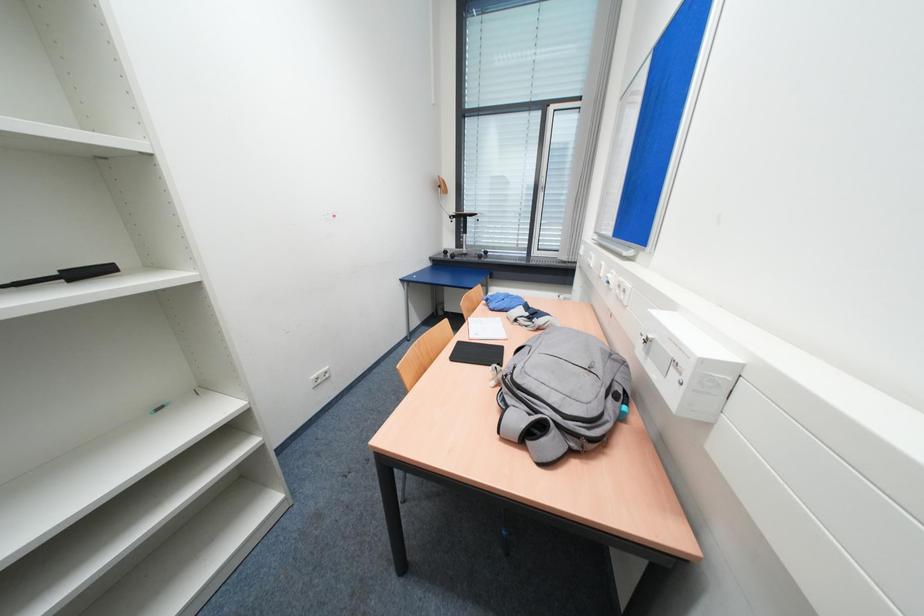
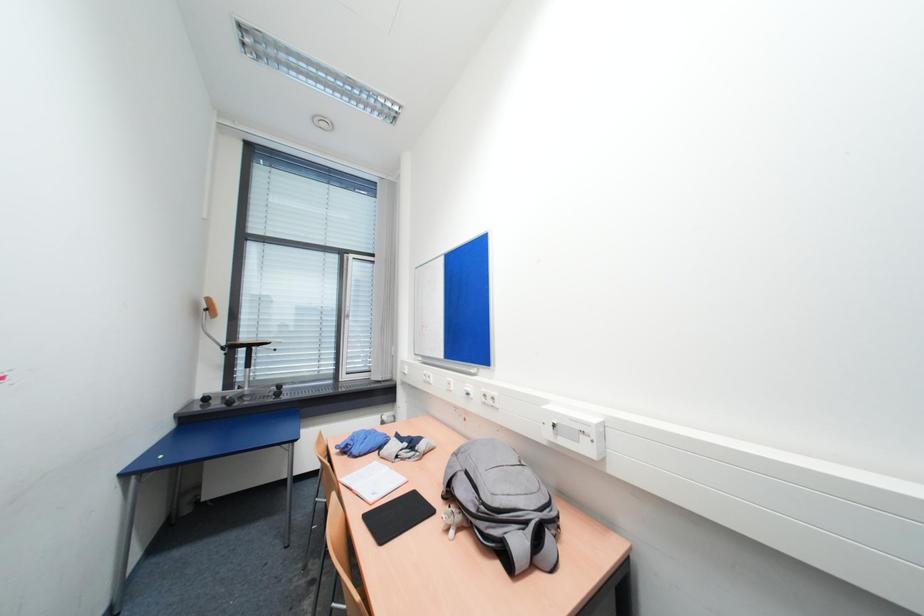
How did the camera likely rotate?

The camera's rotation is toward right-up.